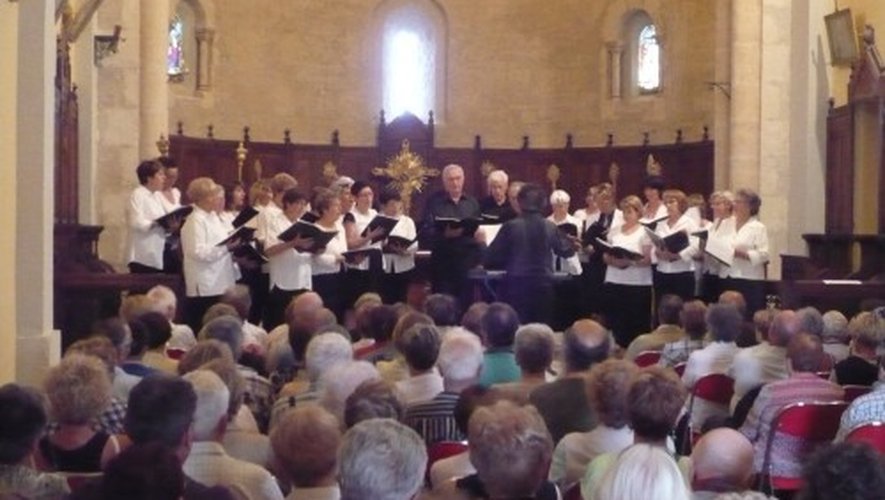
The width and height of the screenshot is (885, 500). Find the location of `carved pillars`. carved pillars is located at coordinates (155, 49), (745, 98).